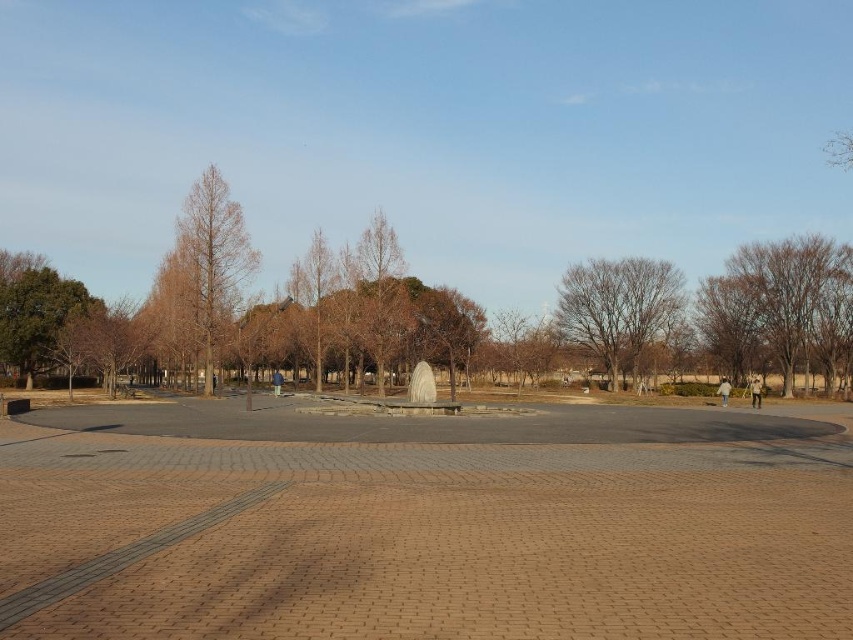
Question: Is brown leafless tree at center to the left of brown matte tree at center from the viewer's perspective?

Choices:
 (A) yes
 (B) no

Answer: (B)

Question: Among these points, which one is nearest to the camera?

Choices:
 (A) (192, 333)
 (B) (355, 244)

Answer: (A)

Question: Which point is farther to the camera?

Choices:
 (A) (633, 339)
 (B) (187, 208)
 (C) (363, 340)

Answer: (A)

Question: Is the position of brown matte tree at left less distant than that of brown matte tree at center?

Choices:
 (A) yes
 (B) no

Answer: (A)

Question: Among these points, which one is nearest to the camera?

Choices:
 (A) (563, 323)
 (B) (398, 275)

Answer: (B)

Question: Is brown matte tree at left smaller than brown matte tree at center?

Choices:
 (A) yes
 (B) no

Answer: (B)